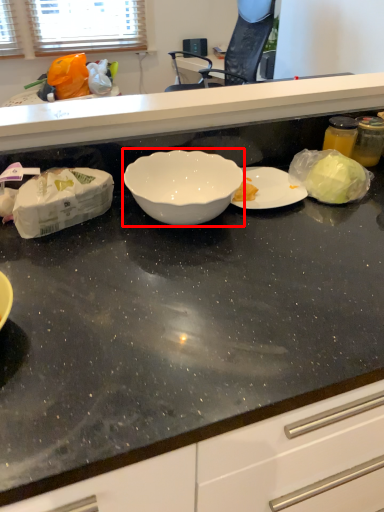
Question: Considering the relative positions of bowl (annotated by the red box) and countertop in the image provided, where is bowl (annotated by the red box) located with respect to the staircase?

Choices:
 (A) left
 (B) right

Answer: (A)